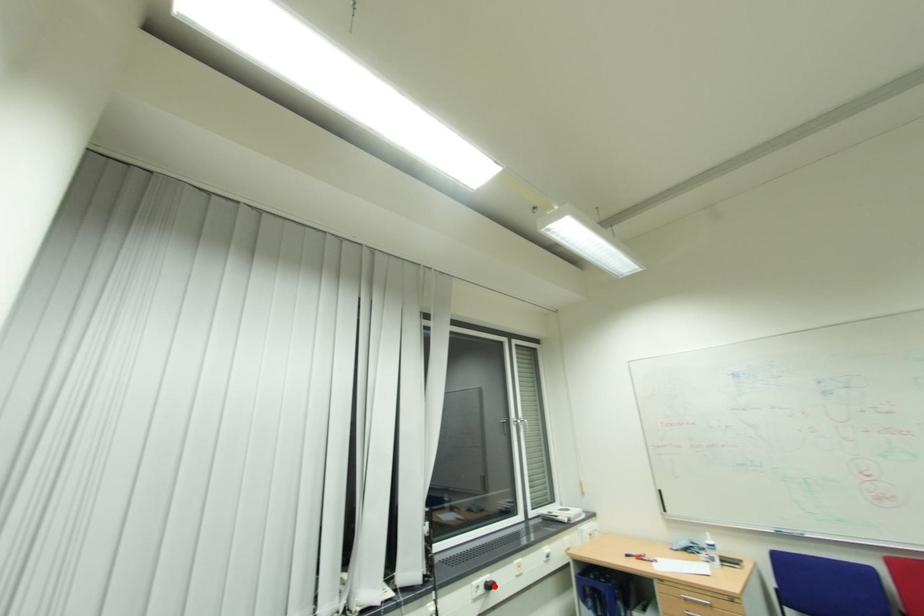
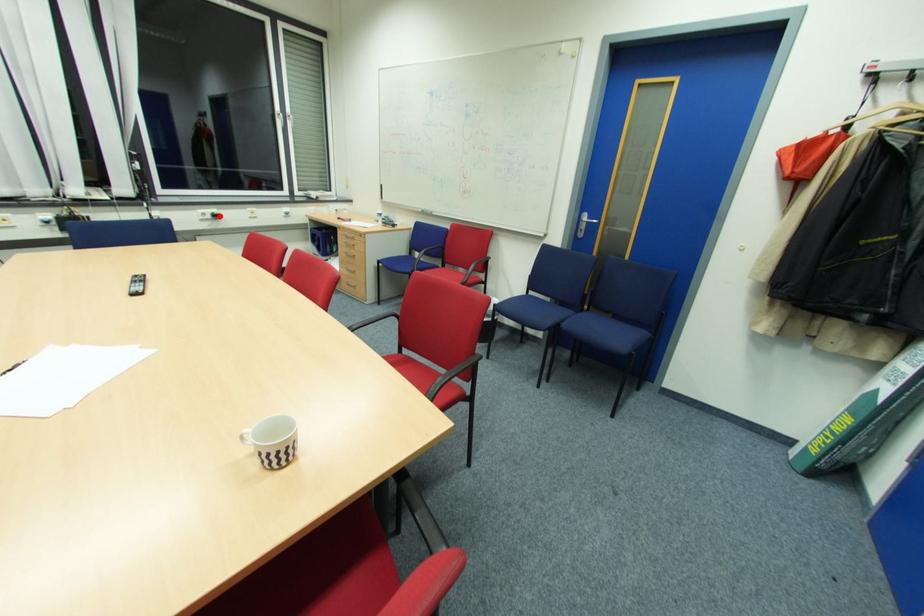
I am providing you with two images of the same scene from different viewpoints. A red point is marked on the first image and another point is marked on the second image. Are the points marked in image1 and image2 representing the same 3D position?

Yes